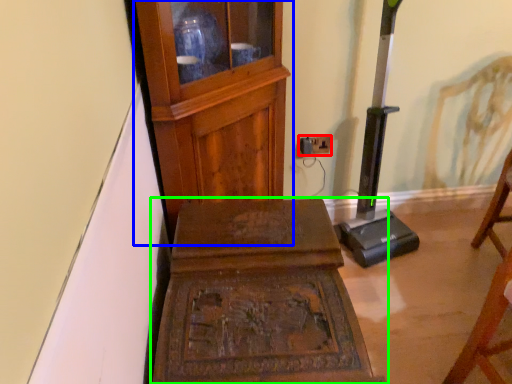
Question: Which object is positioned farthest from electric outlet (highlighted by a red box)? Select from furniture (highlighted by a blue box) and furniture (highlighted by a green box).

Choices:
 (A) furniture
 (B) furniture

Answer: (B)